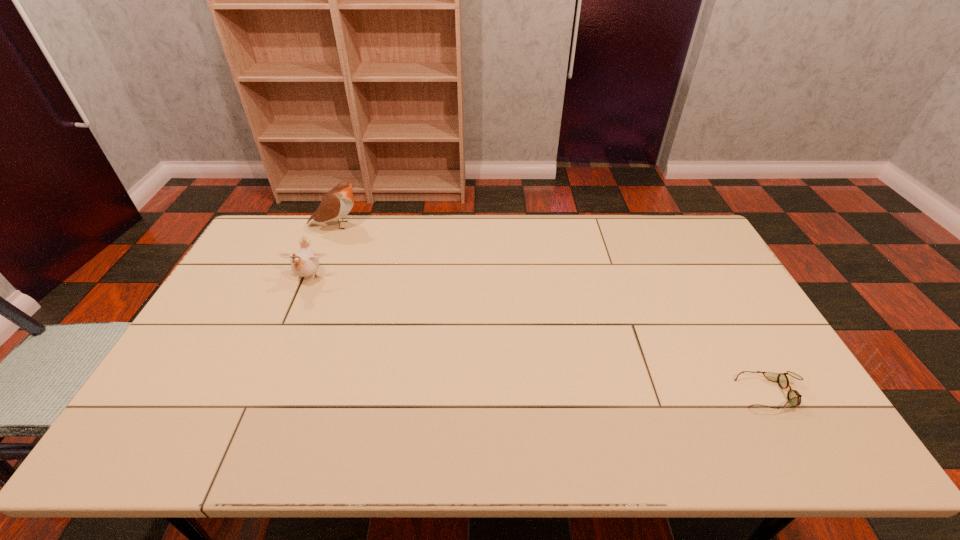
The image size is (960, 540). Identify the location of free space that satisfies the following two spatial constraints: 1. at the face of the farther bird; 2. at the beak of the second tallest object. (x=314, y=278).

Where is `vacant space that satisfies the following two spatial constraints: 1. at the face of the tallest object; 2. at the beak of the second nearest object`? Image resolution: width=960 pixels, height=540 pixels. vacant space that satisfies the following two spatial constraints: 1. at the face of the tallest object; 2. at the beak of the second nearest object is located at coordinates (314, 278).